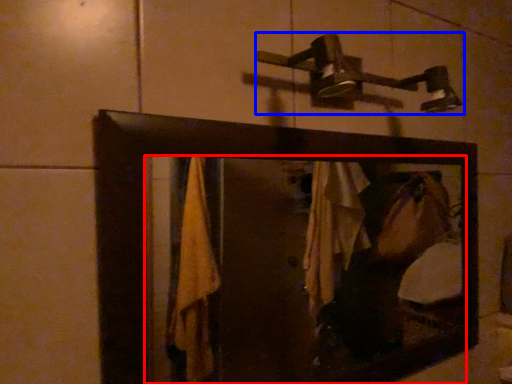
Question: Which object appears closest to the camera in this image, mirror (highlighted by a red box) or shower (highlighted by a blue box)?

Choices:
 (A) mirror
 (B) shower

Answer: (A)